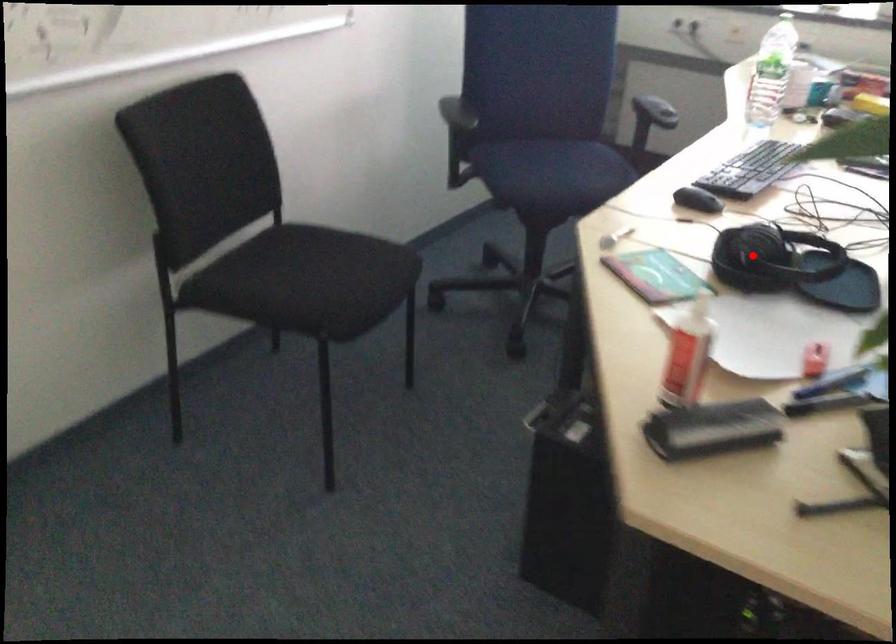
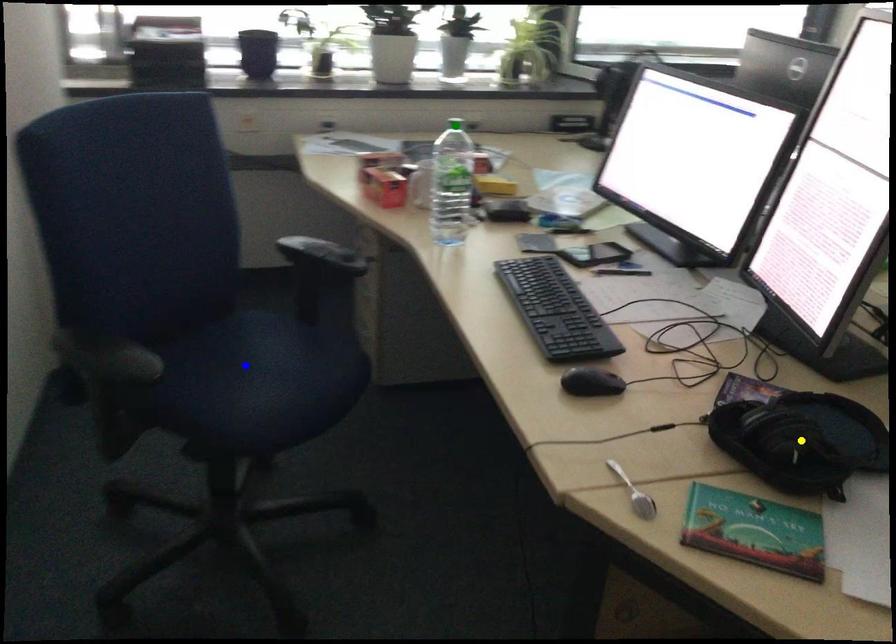
Question: I am providing you with two images of the same scene from different viewpoints. A red point is marked on the first image. You are given multiple points on the second image. Which point in image 2 is actually the same real-world point as the red point in image 1?

Choices:
 (A) yellow point
 (B) green point
 (C) blue point

Answer: (A)